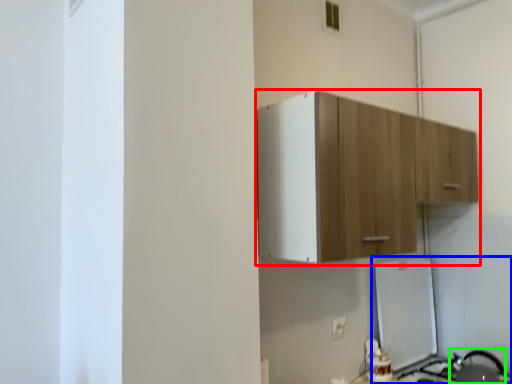
Question: Considering the real-world distances, which object is farthest from cabinetry (highlighted by a red box)? appliance (highlighted by a blue box) or appliance (highlighted by a green box)?

Choices:
 (A) appliance
 (B) appliance

Answer: (B)